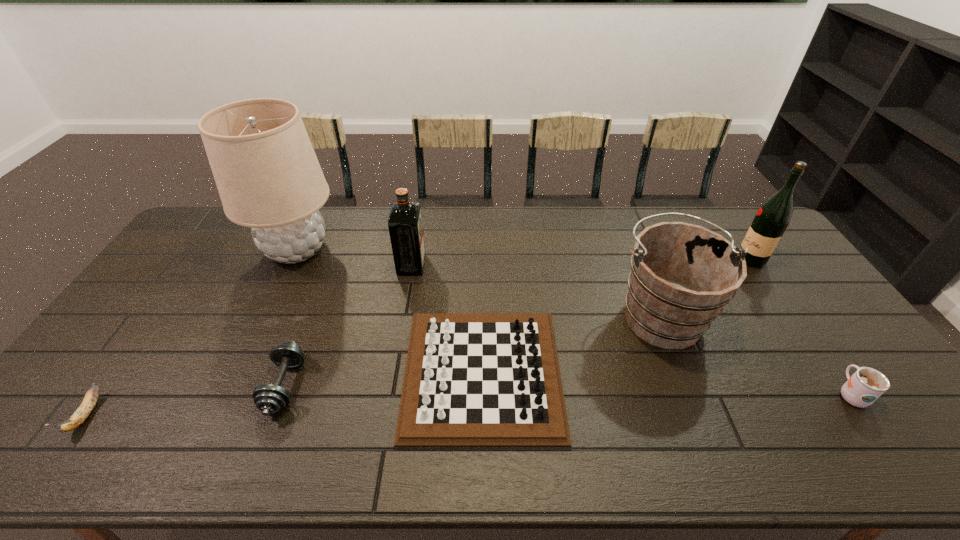
Image resolution: width=960 pixels, height=540 pixels. In order to click on vacant area between the cup and the shorter liquor in this screenshot , I will do `click(631, 329)`.

The height and width of the screenshot is (540, 960). I want to click on vacant space that is in between the cup and the gameboard, so click(x=666, y=383).

Point out which object is positioned as the seventh nearest to the leftmost object. Please provide its 2D coordinates. Your answer should be formatted as a tuple, i.e. [(x, y)], where the tuple contains the x and y coordinates of a point satisfying the conditions above.

[(773, 217)]

Where is `object that stands as the third closest to the taller liquor`? The image size is (960, 540). object that stands as the third closest to the taller liquor is located at coordinates (471, 379).

I want to click on vacant space that satisfies the following two spatial constraints: 1. on the handle side of the bucket; 2. on the front label of the shorter liquor, so click(641, 265).

Where is `vacant space that satisfies the following two spatial constraints: 1. on the side with the handle of the cup; 2. on the front-facing side of the right liquor`? The height and width of the screenshot is (540, 960). vacant space that satisfies the following two spatial constraints: 1. on the side with the handle of the cup; 2. on the front-facing side of the right liquor is located at coordinates (756, 260).